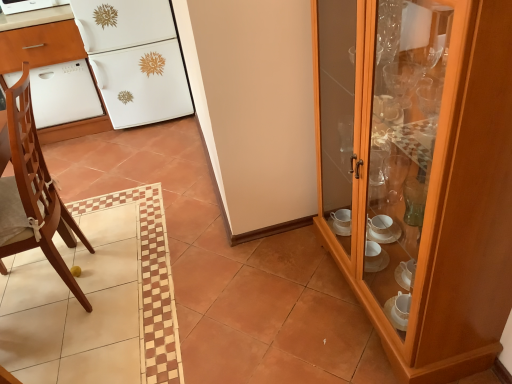
Question: Based on their sizes in the image, would you say white glossy dishwasher at left is bigger or smaller than wooden cabinet at right?

Choices:
 (A) big
 (B) small

Answer: (B)

Question: In the image, is white glossy dishwasher at left positioned in front of or behind wooden cabinet at right?

Choices:
 (A) front
 (B) behind

Answer: (B)

Question: Which object is positioned closest to the white glossy dishwasher at left?

Choices:
 (A) light brown wooden chair at left
 (B) white glossy oven at left
 (C) white glossy dishwasher at upper left
 (D) white glossy refrigerator at upper left
 (E) wooden cabinet at right

Answer: (B)

Question: Estimate the real-world distances between objects in this image. Which object is closer to the wooden cabinet at right?

Choices:
 (A) white glossy refrigerator at upper left
 (B) white glossy dishwasher at left
 (C) light brown wooden chair at left
 (D) white glossy oven at left
 (E) white glossy dishwasher at upper left

Answer: (C)